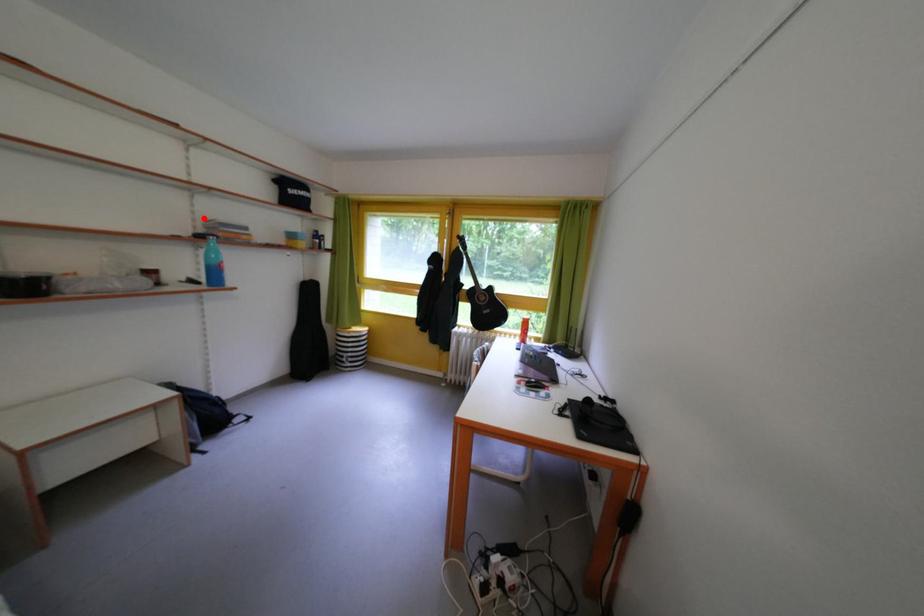
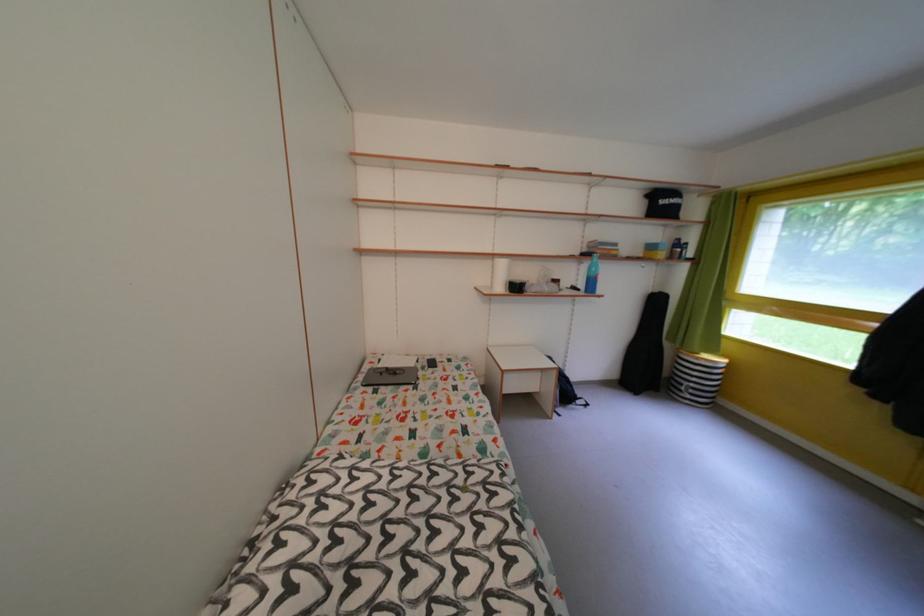
Where in the second image is the point corresponding to the highlighted location from the first image?

(592, 243)